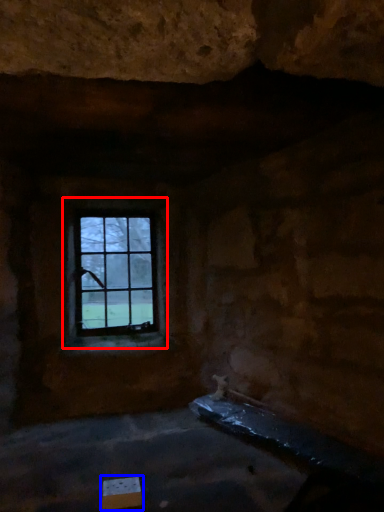
Question: Which object is further to the camera taking this photo, window (highlighted by a red box) or cardboard box (highlighted by a blue box)?

Choices:
 (A) window
 (B) cardboard box

Answer: (A)